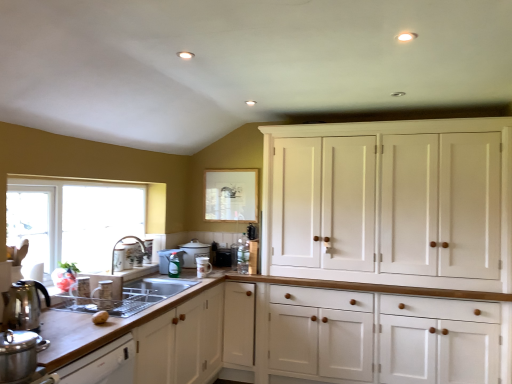
Locate an element on the screen. The width and height of the screenshot is (512, 384). free location in front of matte white cup at sink, which is the 5th appliance in back-to-front order is located at coordinates pyautogui.click(x=88, y=311).